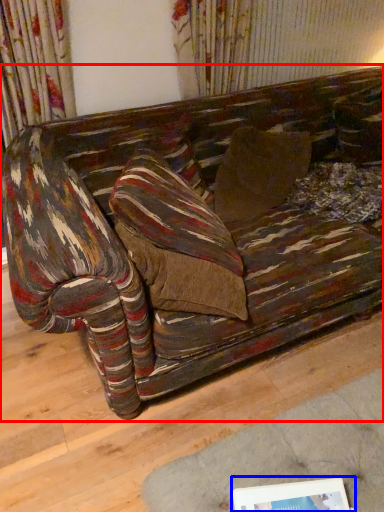
Question: Which of the following is the closest to the observer, studio couch (highlighted by a red box) or picture frame (highlighted by a blue box)?

Choices:
 (A) studio couch
 (B) picture frame

Answer: (B)